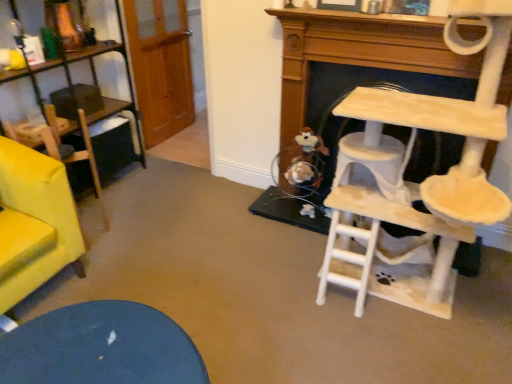
You are a GUI agent. You are given a task and a screenshot of the screen. Output one action in this format:
    pyautogui.click(x=<x>, y=<y>)
    Task: Click on the free space to the left of beige wooden cat tree at right
    Image resolution: width=512 pixels, height=384 pixels.
    Given the screenshot: What is the action you would take?
    pyautogui.click(x=265, y=289)